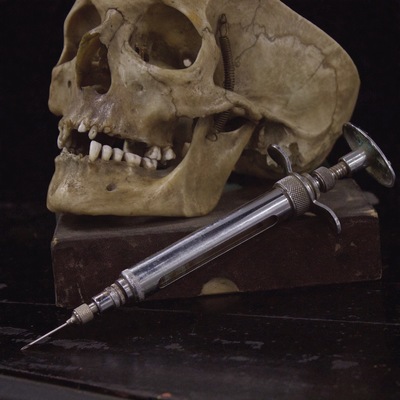
The width and height of the screenshot is (400, 400). I want to click on table, so click(x=320, y=301).